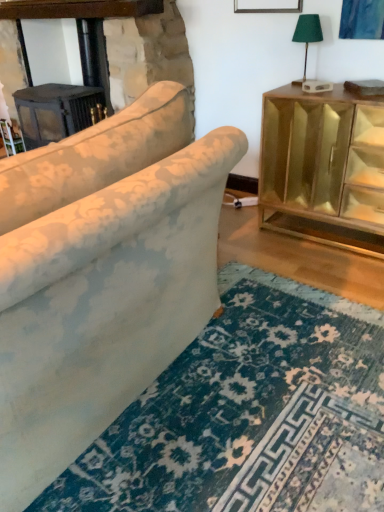
Question: From a real-world perspective, relative to green fabric lampshade at upper right, is floral fabric couch at center vertically above or below?

Choices:
 (A) below
 (B) above

Answer: (A)

Question: In terms of size, does floral fabric couch at center appear bigger or smaller than green fabric lampshade at upper right?

Choices:
 (A) small
 (B) big

Answer: (B)

Question: Which of these objects is positioned closest to the green fabric lampshade at upper right?

Choices:
 (A) gold mirrored cabinet at right
 (B) dark gray wood fireplace at upper left
 (C) floral fabric couch at center

Answer: (A)

Question: Considering the real-world distances, which object is farthest from the gold mirrored cabinet at right?

Choices:
 (A) floral fabric couch at center
 (B) green fabric lampshade at upper right
 (C) dark gray wood fireplace at upper left

Answer: (C)